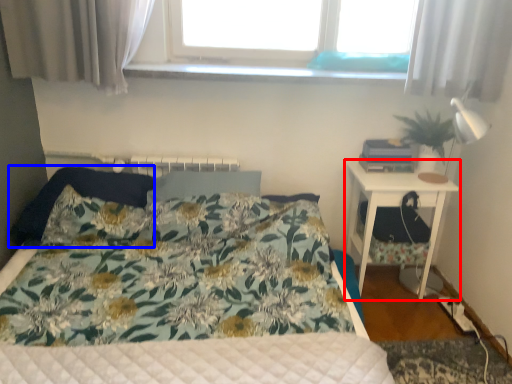
Question: Which object appears closest to the camera in this image, nightstand (highlighted by a red box) or pillow (highlighted by a blue box)?

Choices:
 (A) nightstand
 (B) pillow

Answer: (B)